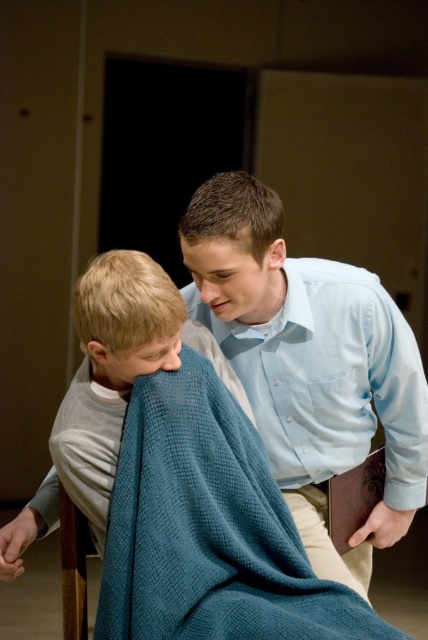
Can you confirm if light blue cotton shirt at upper center is bigger than light blue textured blanket at lower left?

No, light blue cotton shirt at upper center is not bigger than light blue textured blanket at lower left.

In the scene shown: Between light blue cotton shirt at upper center and light blue textured blanket at lower left, which one appears on the left side from the viewer's perspective?

light blue textured blanket at lower left is more to the left.

Identify the location of light blue cotton shirt at upper center. This screenshot has height=640, width=428. (332, 378).

From the picture: Measure the distance between point (376, 401) and camera.

They are 6.10 feet apart.

Is light blue shirt at center positioned behind light blue cotton shirt at upper center?

That is False.

Where is `light blue shirt at center`? light blue shirt at center is located at coordinates (309, 362).

Is point (368, 371) closer to camera compared to point (74, 630)?

No, (368, 371) is further to viewer.

Who is more forward, (x=184, y=298) or (x=68, y=630)?

Positioned in front is point (x=68, y=630).

I want to click on light blue cotton shirt at upper center, so click(x=332, y=378).